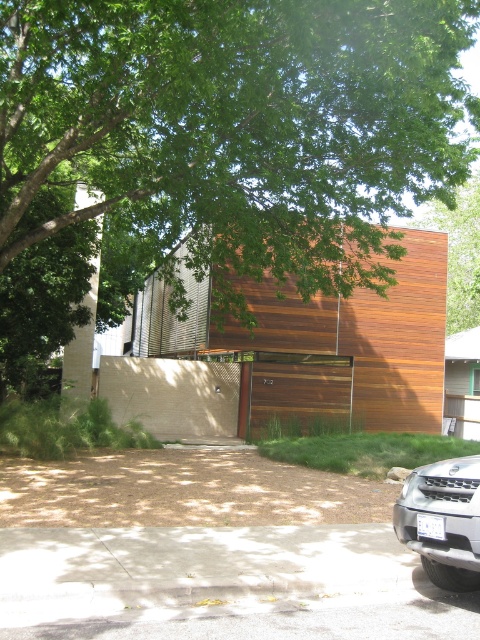
Is the position of brown mulch at lower center less distant than that of silver metallic suv at lower right?

No.

Consider the image. Which of these two, brown mulch at lower center or silver metallic suv at lower right, stands shorter?

With less height is brown mulch at lower center.

Between point (90, 452) and point (424, 481), which one is positioned in front?

Positioned in front is point (424, 481).

At what (x,y) coordinates should I click in order to perform the action: click on brown mulch at lower center. Please return your answer as a coordinate pair (x, y). Image resolution: width=480 pixels, height=640 pixels. Looking at the image, I should click on (183, 490).

Is brown mulch at lower center above wooden garage door at center?

No, brown mulch at lower center is not above wooden garage door at center.

Which is below, brown mulch at lower center or wooden garage door at center?

brown mulch at lower center is lower down.

Is point (388, 499) less distant than point (278, 396)?

Yes, point (388, 499) is closer to viewer.

I want to click on brown mulch at lower center, so click(183, 490).

Does green leafy tree at upper center have a lesser height compared to silver metallic suv at lower right?

Incorrect, green leafy tree at upper center's height does not fall short of silver metallic suv at lower right's.

Can you confirm if green leafy tree at upper center is positioned to the left of silver metallic suv at lower right?

Indeed, green leafy tree at upper center is positioned on the left side of silver metallic suv at lower right.

Where is `green leafy tree at upper center`? green leafy tree at upper center is located at coordinates (228, 134).